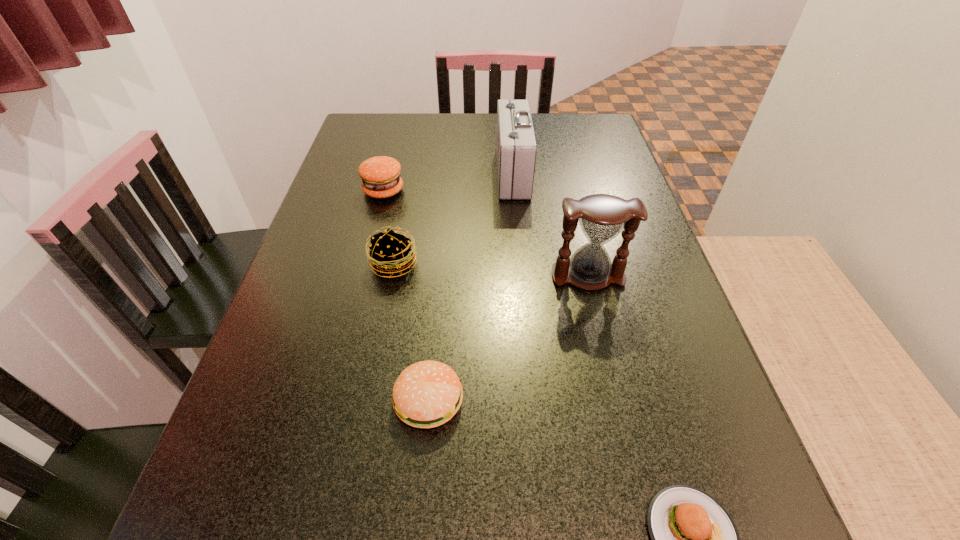
Where is `free space that is in between the fourth object from left to right and the hourglass`? This screenshot has height=540, width=960. free space that is in between the fourth object from left to right and the hourglass is located at coordinates (550, 225).

Identify the location of free spot between the first-aid kit and the second farthest food. (453, 219).

Find the location of `vacant region between the fifth tallest object and the first-aid kit`. vacant region between the fifth tallest object and the first-aid kit is located at coordinates (470, 287).

Image resolution: width=960 pixels, height=540 pixels. Identify the location of free space between the second farthest food and the farthest food. (389, 227).

Identify the location of free point between the second nearest object and the fourth object from left to right. Image resolution: width=960 pixels, height=540 pixels. (470, 287).

Find the location of `unoccupied area between the third object from right to left and the hourglass`. unoccupied area between the third object from right to left and the hourglass is located at coordinates (550, 225).

What are the coordinates of `object that is the fourth closest to the nearest food` in the screenshot? It's located at (516, 148).

Locate which object is the second closest to the second farthest food. Please provide its 2D coordinates. Your answer should be formatted as a tuple, i.e. [(x, y)], where the tuple contains the x and y coordinates of a point satisfying the conditions above.

[(427, 394)]

Locate an element on the screen. Image resolution: width=960 pixels, height=540 pixels. food object that ranks as the third closest to the shortest object is located at coordinates (380, 175).

At what (x,y) coordinates should I click in order to perform the action: click on food that stands as the closest to the shortest object. Please return your answer as a coordinate pair (x, y). Image resolution: width=960 pixels, height=540 pixels. Looking at the image, I should click on (427, 394).